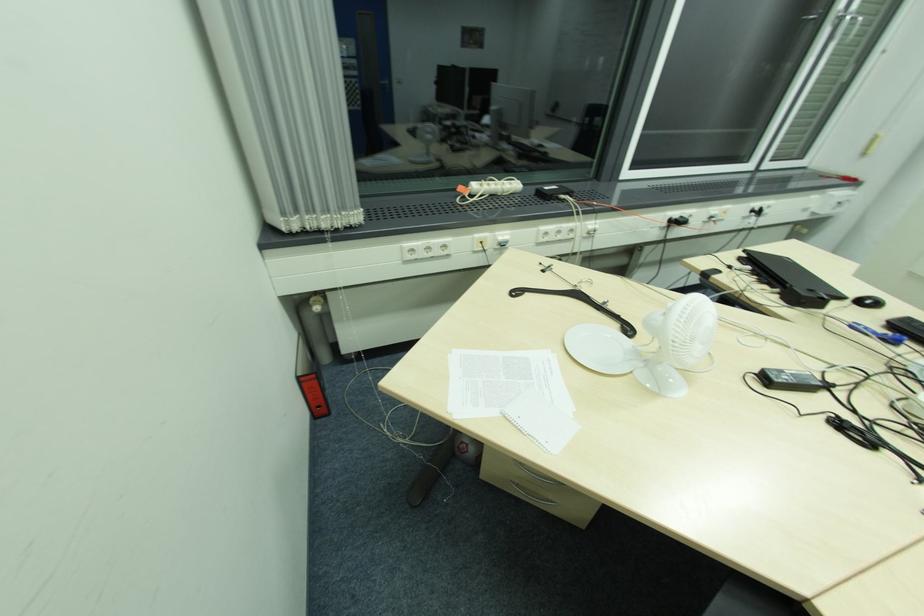
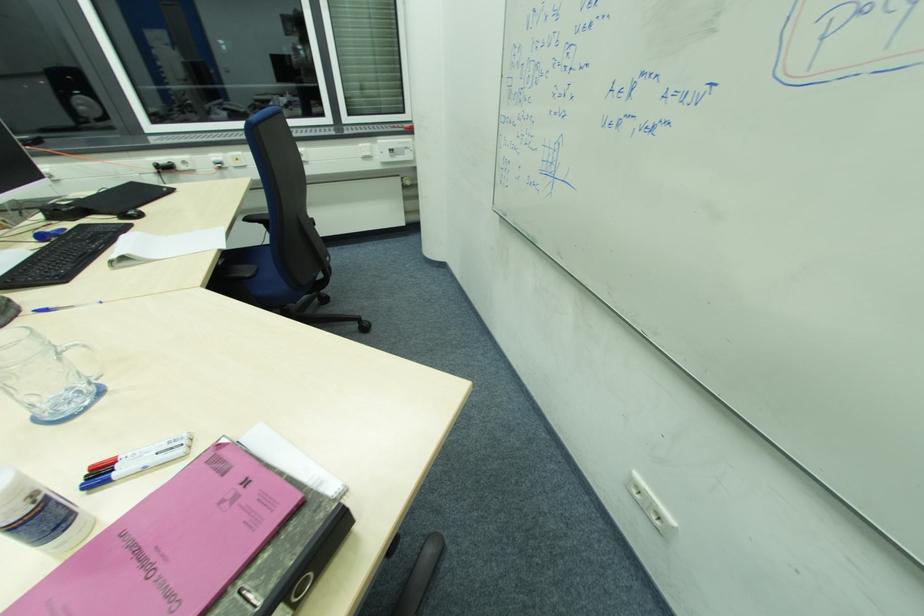
Question: In a continuous first-person perspective shot, in which direction is the camera moving?

Choices:
 (A) Left
 (B) Right
 (C) Forward
 (D) Backward

Answer: (B)